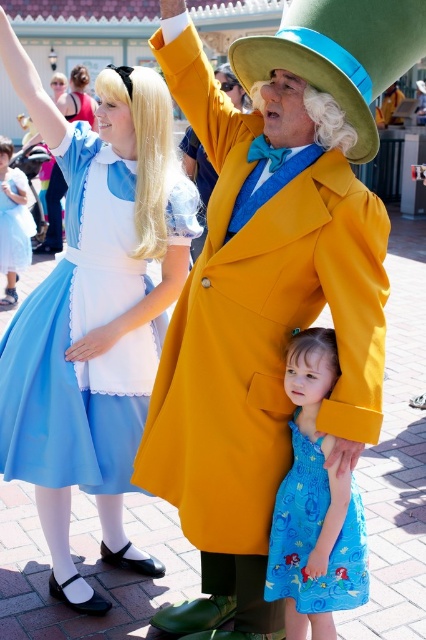
Question: Which point is closer to the camera?

Choices:
 (A) (19, 353)
 (B) (379, 38)
 (C) (8, 250)
 (D) (184, 80)

Answer: (B)

Question: Can you confirm if green felt dress hat at upper center is smaller than blue printed fabric dress at lower center?

Choices:
 (A) yes
 (B) no

Answer: (B)

Question: Can you confirm if blue printed fabric dress at lower center is smaller than light blue satin dress at left?

Choices:
 (A) no
 (B) yes

Answer: (B)

Question: Which point is closer to the camera taking this photo?

Choices:
 (A) (339, 564)
 (B) (69, 385)

Answer: (A)

Question: Which of the following is the farthest from the observer?

Choices:
 (A) (250, 54)
 (B) (319, 490)
 (C) (143, 260)

Answer: (C)

Question: Is green felt dress hat at upper center behind light blue satin dress at left?

Choices:
 (A) no
 (B) yes

Answer: (A)